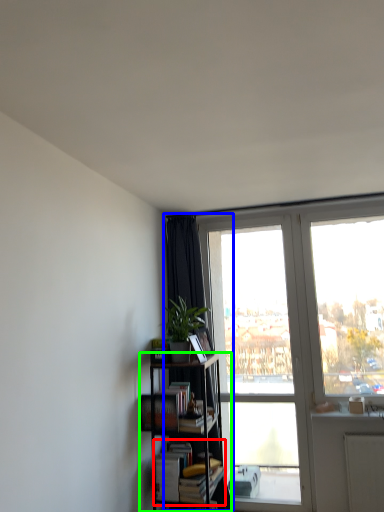
Question: Which object is the farthest from book (highlighted by a red box)? Choose among these: curtain (highlighted by a blue box) or bookcase (highlighted by a green box).

Choices:
 (A) curtain
 (B) bookcase

Answer: (A)